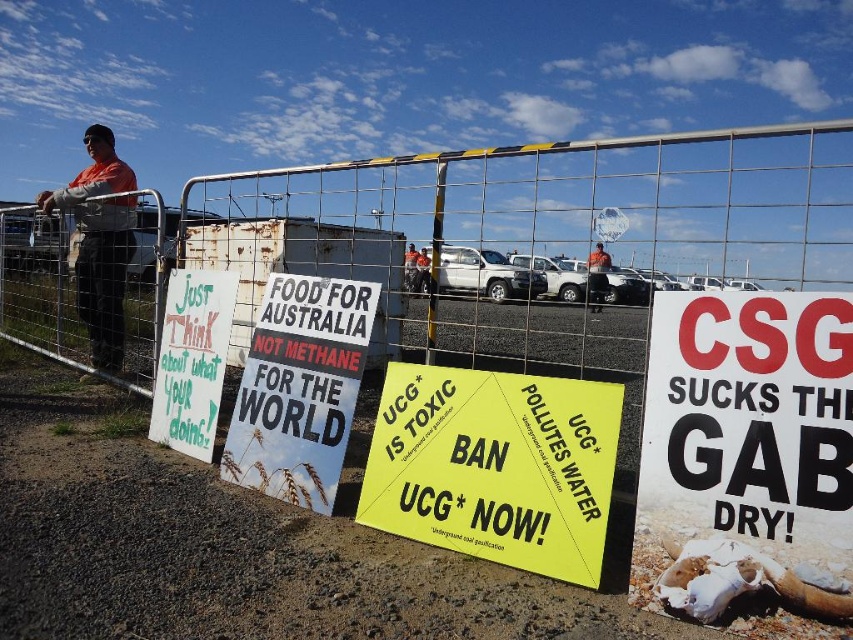
Is yellow paper sign at center shorter than orange shirt at center?

No.

Locate an element on the screen. This screenshot has width=853, height=640. yellow paper sign at center is located at coordinates (495, 467).

I want to click on yellow paper sign at center, so click(x=495, y=467).

Is white paper sign at center right thinner than white paper poster at center?

Indeed, white paper sign at center right has a lesser width compared to white paper poster at center.

You are a GUI agent. You are given a task and a screenshot of the screen. Output one action in this format:
    pyautogui.click(x=<x>, y=<y>)
    Task: Click on the white paper sign at center right
    The image size is (853, 640).
    Given the screenshot: What is the action you would take?
    pyautogui.click(x=749, y=416)

Which is more to the right, white paper sign at center right or orange shirt at left?

Positioned to the right is white paper sign at center right.

Is white paper sign at center right above orange shirt at left?

Actually, white paper sign at center right is below orange shirt at left.

Find the location of a particular element. The image size is (853, 640). white paper sign at center right is located at coordinates (749, 416).

The image size is (853, 640). Identify the location of white paper sign at center right. (749, 416).